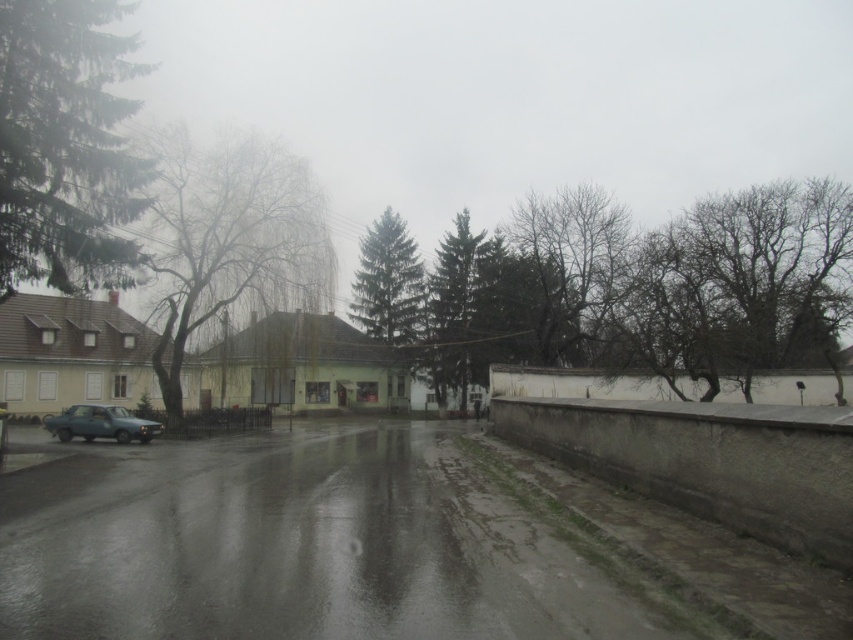
How much distance is there between green leafy tree at center and metallic blue car at lower left?

green leafy tree at center and metallic blue car at lower left are 99.26 feet apart.

Is green leafy tree at center below metallic blue car at lower left?

No, green leafy tree at center is not below metallic blue car at lower left.

Between point (743, 369) and point (91, 424), which one is positioned in front?

Point (743, 369) is more forward.

The width and height of the screenshot is (853, 640). In order to click on green leafy tree at center in this screenshot , I will do `click(647, 288)`.

Which is in front, point (161, 144) or point (460, 385)?

Positioned in front is point (161, 144).

Can you confirm if green leafy tree at left is positioned to the left of green matte tree at center?

Indeed, green leafy tree at left is positioned on the left side of green matte tree at center.

At what (x,y) coordinates should I click in order to perform the action: click on green leafy tree at left. Please return your answer as a coordinate pair (x, y). Image resolution: width=853 pixels, height=640 pixels. Looking at the image, I should click on (228, 241).

The height and width of the screenshot is (640, 853). Find the location of `green leafy tree at left`. green leafy tree at left is located at coordinates (228, 241).

Who is taller, green leafy tree at center or green leafy tree at left?

green leafy tree at center

Describe the element at coordinates (647, 288) in the screenshot. This screenshot has height=640, width=853. I see `green leafy tree at center` at that location.

What are the coordinates of `green leafy tree at center` in the screenshot? It's located at (647, 288).

You are a GUI agent. You are given a task and a screenshot of the screen. Output one action in this format:
    pyautogui.click(x=<x>, y=<y>)
    Task: Click on the green leafy tree at center
    
    Given the screenshot: What is the action you would take?
    pyautogui.click(x=647, y=288)